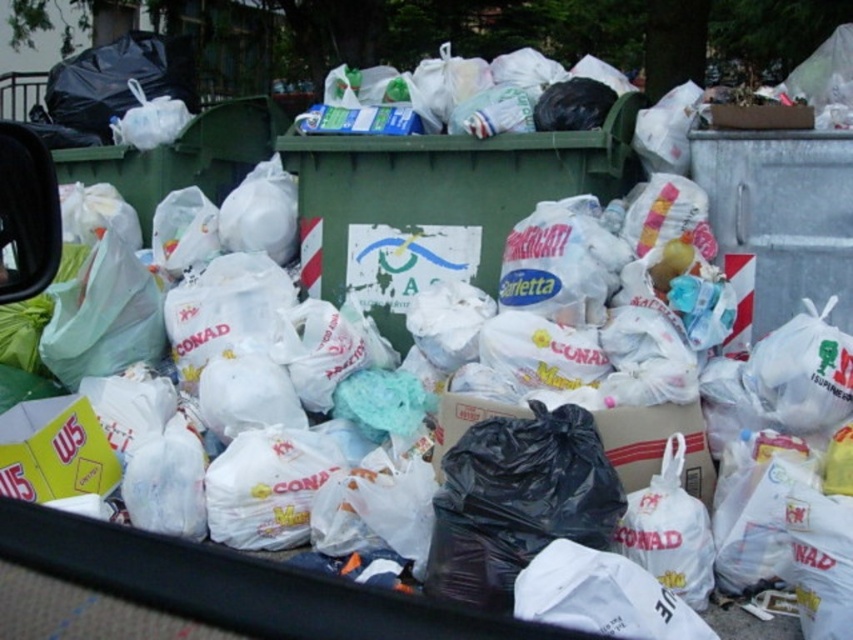
Does green plastic recycling bin at center appear on the left side of metallic gray recycling bin at upper right?

Yes, green plastic recycling bin at center is to the left of metallic gray recycling bin at upper right.

Is green plastic recycling bin at center smaller than metallic gray recycling bin at upper right?

No, green plastic recycling bin at center is not smaller than metallic gray recycling bin at upper right.

In order to click on green plastic recycling bin at center in this screenshot , I will do `click(445, 188)`.